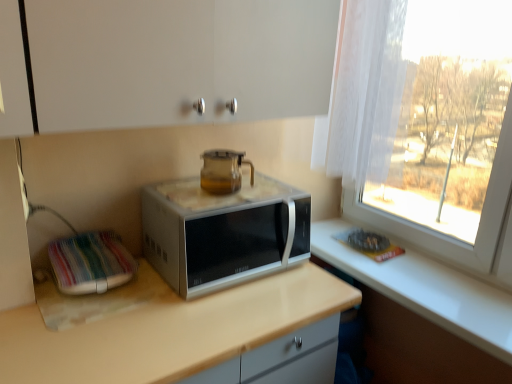
Identify the location of space that is in front of satin silver microwave at center. The image size is (512, 384). (205, 325).